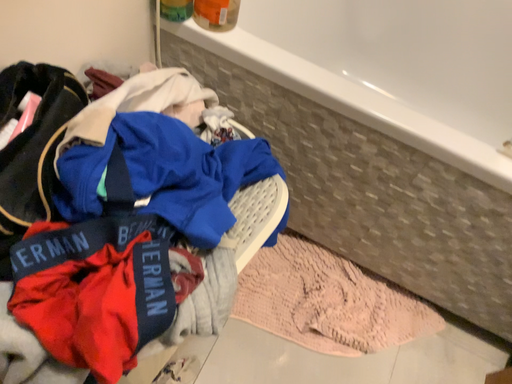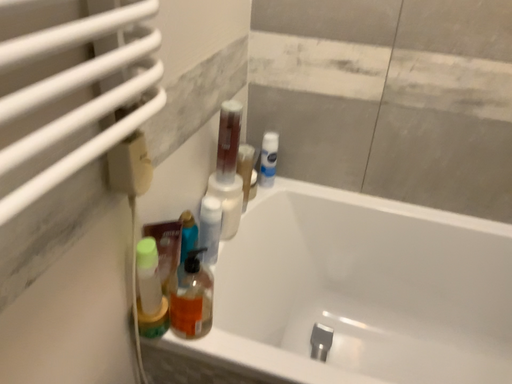
Question: How did the camera likely rotate when shooting the video?

Choices:
 (A) rotated upward
 (B) rotated downward

Answer: (A)